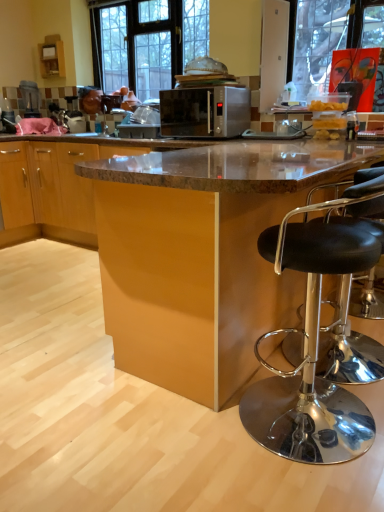
Question: From a real-world perspective, is satin silver microwave at center located beneath black leather stool at right?

Choices:
 (A) no
 (B) yes

Answer: (A)

Question: Considering the relative sizes of satin silver microwave at center and black leather stool at right in the image provided, is satin silver microwave at center smaller than black leather stool at right?

Choices:
 (A) yes
 (B) no

Answer: (A)

Question: Would you say satin silver microwave at center is a long distance from black leather stool at right?

Choices:
 (A) yes
 (B) no

Answer: (A)

Question: Is satin silver microwave at center not inside black leather stool at right?

Choices:
 (A) no
 (B) yes

Answer: (B)

Question: Is satin silver microwave at center taller than black leather stool at right?

Choices:
 (A) yes
 (B) no

Answer: (B)

Question: Is satin silver microwave at center looking in the opposite direction of black leather stool at right?

Choices:
 (A) yes
 (B) no

Answer: (B)

Question: Are brown glossy table at center and black glass window at upper center located far from each other?

Choices:
 (A) yes
 (B) no

Answer: (A)

Question: Does brown glossy table at center come in front of black glass window at upper center?

Choices:
 (A) yes
 (B) no

Answer: (A)

Question: From the image's perspective, is brown glossy table at center located above black glass window at upper center?

Choices:
 (A) yes
 (B) no

Answer: (B)

Question: Is brown glossy table at center outside black glass window at upper center?

Choices:
 (A) no
 (B) yes

Answer: (B)

Question: Does brown glossy table at center lie behind black glass window at upper center?

Choices:
 (A) yes
 (B) no

Answer: (B)

Question: Does brown glossy table at center contain black glass window at upper center?

Choices:
 (A) no
 (B) yes

Answer: (A)

Question: From a real-world perspective, is black glass window at upper center positioned under black leather stool at right based on gravity?

Choices:
 (A) no
 (B) yes

Answer: (A)